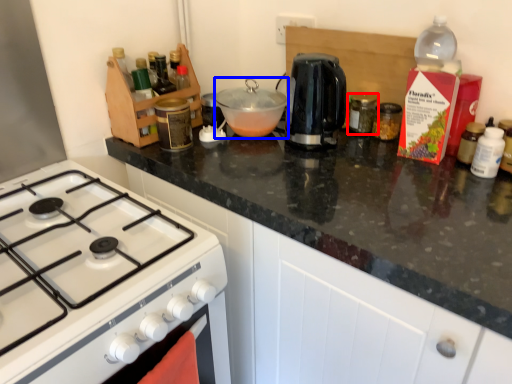
Question: Which object appears closest to the camera in this image, kitchen appliance (highlighted by a red box) or kitchen appliance (highlighted by a blue box)?

Choices:
 (A) kitchen appliance
 (B) kitchen appliance

Answer: (B)